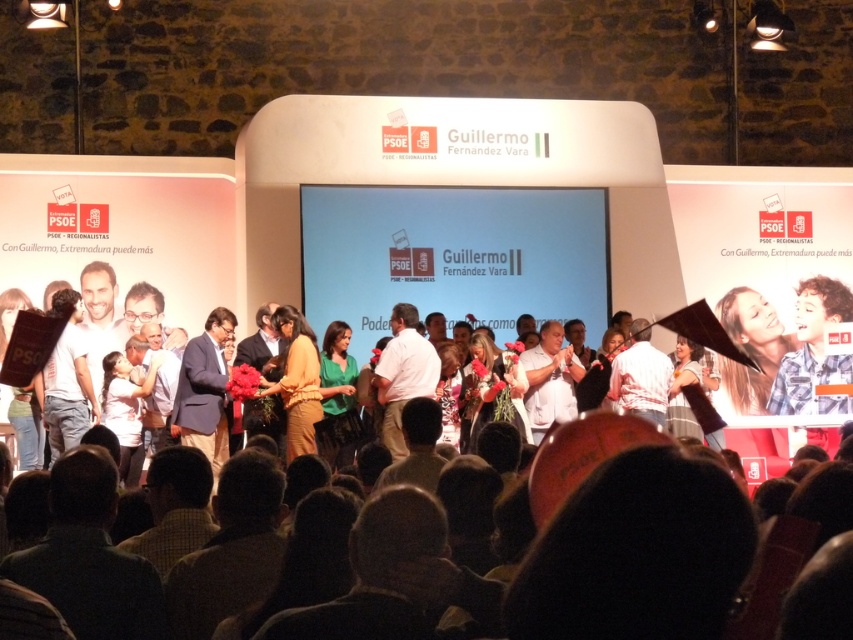
You are standing at the back of the hall and want to approach the stage. There are two points marked on the floor where you can step closer to the stage. The first point is at coordinate point (317, 406) and the second is at coordinate point (554, 358). Which point is closer to the stage?

Answer: Point (317, 406) is in front of point (554, 358), so it is closer to the stage.

You are a photographer at the event and need to frame a photo that includes both the matte yellow dress at center and the green matte shirt at center. Which object should you position wider in your camera viewfinder to ensure both are fully visible?

The matte yellow dress at center is wider than the green matte shirt at center, so you should position the matte yellow dress at center wider in your camera viewfinder to accommodate its larger size while ensuring the green matte shirt at center also fits within the frame.

You are attending the political event and notice two shirts on the stage. The green matte shirt at center and the white cotton shirt at center. Which one is taller?

The green matte shirt at center is taller than the white cotton shirt at center.